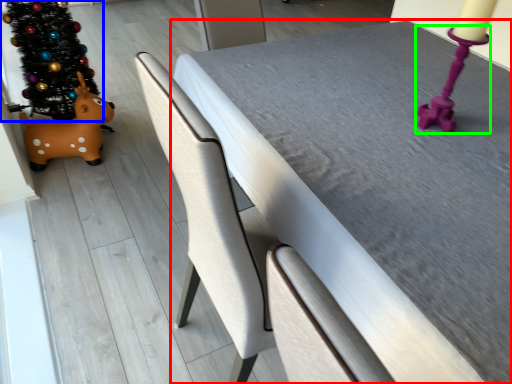
Question: Estimate the real-world distances between objects in this image. Which object is farther from table (highlighted by a red box), christmas tree (highlighted by a blue box) or candle holder (highlighted by a green box)?

Choices:
 (A) christmas tree
 (B) candle holder

Answer: (A)